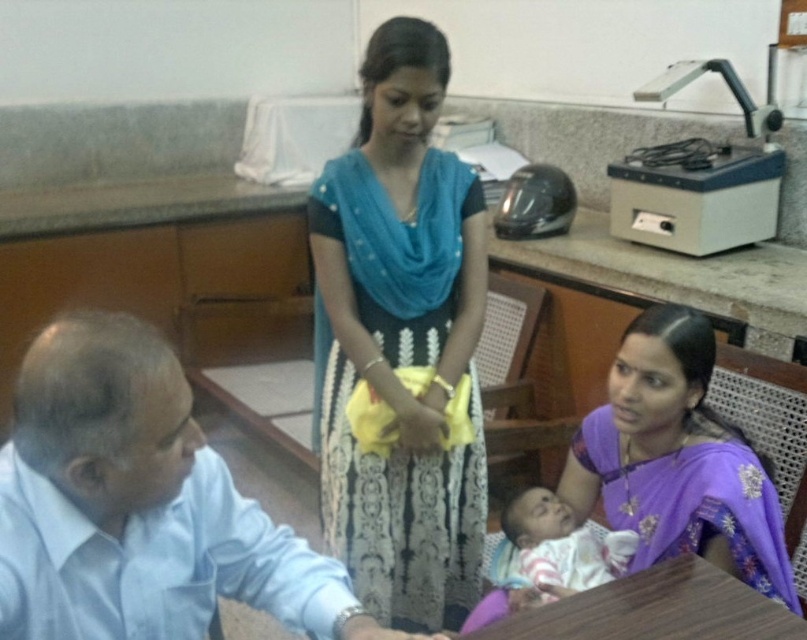
You are observing a scene where a man in a light blue shirt at left is talking to a woman in a purple silk saree at lower right. Which clothing item is located more to the left side of the scene?

The light blue shirt at left is positioned on the left side of the purple silk saree at lower right, so the light blue shirt at left is more to the left.

You are standing in the office and need to hand a document to both the person wearing the light blue shirt at left and the one in the purple silk saree at lower right. Which individual should you approach first based on their proximity to you?

You should approach the light blue shirt at left first because it is closer to you than the purple silk saree at lower right.

You are a tailor in the office and need to measure the distance between the blue fabric dress at center and the purple silk saree at lower right. Can you confirm if the distance is less than 20 inches?

The blue fabric dress at center and purple silk saree at lower right are 19.70 inches apart from each other, so yes, the distance is less than 20 inches.